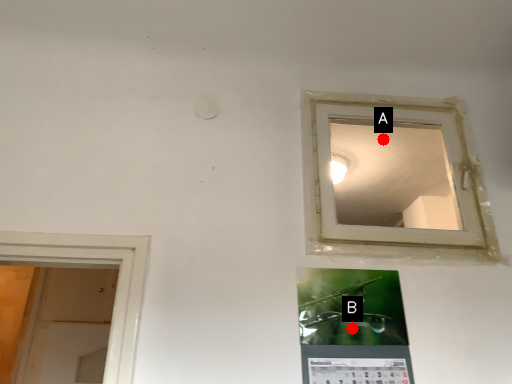
Question: Two points are circled on the image, labeled by A and B beside each circle. Which point is closer to the camera taking this photo?

Choices:
 (A) A is closer
 (B) B is closer

Answer: (B)